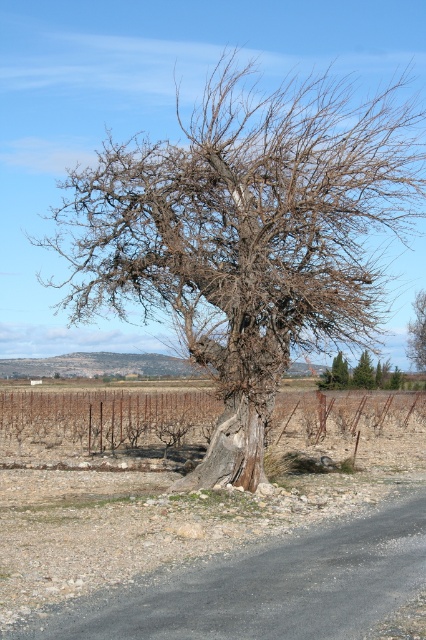
Which is below, bare wood tree at center or green textured pine tree at center?

green textured pine tree at center is lower down.

Who is more forward, (362, 198) or (377, 371)?

Point (362, 198) is more forward.

Locate an element on the screen. The width and height of the screenshot is (426, 640). bare wood tree at center is located at coordinates (247, 236).

Who is higher up, bare wood tree at center or bark textured tree at center?

bare wood tree at center is above.

This screenshot has height=640, width=426. Find the location of `bare wood tree at center`. bare wood tree at center is located at coordinates (247, 236).

Which is behind, point (207, 358) or point (408, 332)?

The point (408, 332) is behind.

Where is `bare wood tree at center`? Image resolution: width=426 pixels, height=640 pixels. bare wood tree at center is located at coordinates (247, 236).

Can you confirm if bark textured tree at center is taller than green matte evergreen tree at center?

Correct, bark textured tree at center is much taller as green matte evergreen tree at center.

Identify the location of bark textured tree at center. This screenshot has width=426, height=640. (417, 332).